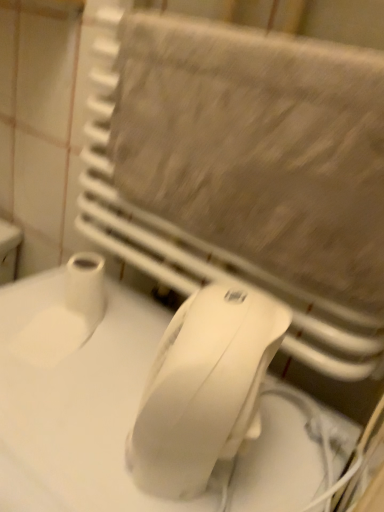
Question: From the image's perspective, would you say white plastic mouse at center is positioned over beige textured towel at upper center?

Choices:
 (A) no
 (B) yes

Answer: (A)

Question: Would you say white plastic mouse at center is outside beige textured towel at upper center?

Choices:
 (A) yes
 (B) no

Answer: (A)

Question: Is white plastic mouse at center looking in the opposite direction of beige textured towel at upper center?

Choices:
 (A) yes
 (B) no

Answer: (B)

Question: From the image's perspective, is white plastic mouse at center located beneath beige textured towel at upper center?

Choices:
 (A) no
 (B) yes

Answer: (B)

Question: Is white plastic mouse at center smaller than beige textured towel at upper center?

Choices:
 (A) no
 (B) yes

Answer: (A)

Question: Does white plastic mouse at center have a greater height compared to beige textured towel at upper center?

Choices:
 (A) no
 (B) yes

Answer: (A)

Question: Can white matte toilet paper at lower left be found inside white matte countertop at lower left?

Choices:
 (A) yes
 (B) no

Answer: (B)

Question: From a real-world perspective, is white matte countertop at lower left positioned under white matte toilet paper at lower left based on gravity?

Choices:
 (A) yes
 (B) no

Answer: (A)

Question: Considering the relative positions of white matte countertop at lower left and white matte toilet paper at lower left in the image provided, is white matte countertop at lower left to the left of white matte toilet paper at lower left from the viewer's perspective?

Choices:
 (A) yes
 (B) no

Answer: (A)

Question: Considering the relative sizes of white matte countertop at lower left and white matte toilet paper at lower left in the image provided, is white matte countertop at lower left shorter than white matte toilet paper at lower left?

Choices:
 (A) yes
 (B) no

Answer: (B)

Question: Is white matte countertop at lower left behind white matte toilet paper at lower left?

Choices:
 (A) no
 (B) yes

Answer: (A)

Question: From the image's perspective, is white matte countertop at lower left below white matte toilet paper at lower left?

Choices:
 (A) yes
 (B) no

Answer: (A)

Question: From a real-world perspective, is white matte countertop at lower left located higher than white plastic mouse at center?

Choices:
 (A) yes
 (B) no

Answer: (B)